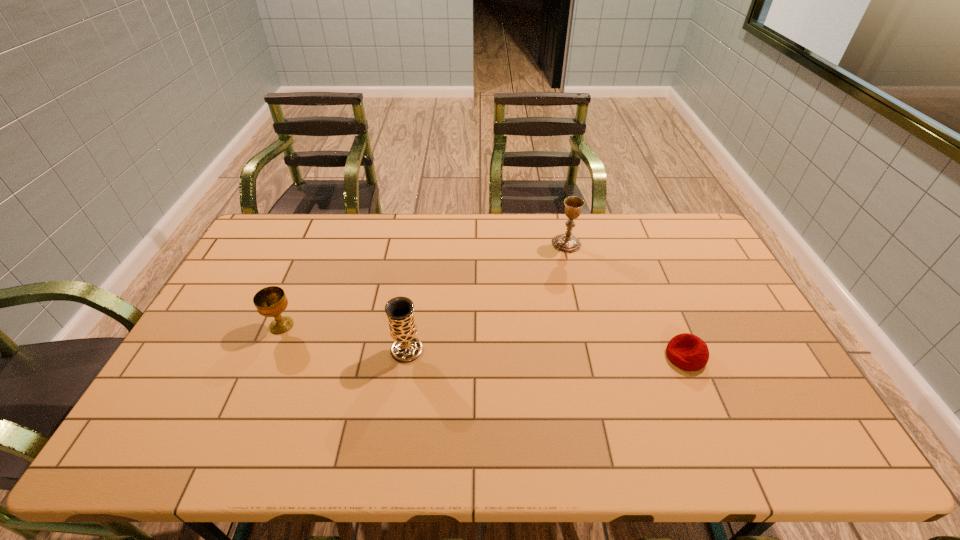
Locate an element on the screen. The height and width of the screenshot is (540, 960). vacant area located 0.270m on the right of the second farthest object is located at coordinates (388, 325).

In order to click on blank space located 0.220m on the seat area of the beanbag in this screenshot , I will do `click(587, 356)`.

This screenshot has width=960, height=540. What are the coordinates of `free spot located 0.060m on the seat area of the beanbag` in the screenshot? It's located at (644, 356).

Where is `vacant space situated on the seat area of the beanbag`? vacant space situated on the seat area of the beanbag is located at coordinates (557, 356).

Locate an element on the screen. This screenshot has width=960, height=540. object situated at the far edge is located at coordinates (567, 243).

Where is `vacant area at the far edge of the desktop`? This screenshot has width=960, height=540. vacant area at the far edge of the desktop is located at coordinates (367, 254).

You are a GUI agent. You are given a task and a screenshot of the screen. Output one action in this format:
    pyautogui.click(x=<x>, y=<y>)
    Task: Click on the vacant space at the near edge of the desktop
    
    Given the screenshot: What is the action you would take?
    pyautogui.click(x=224, y=433)

At what (x,y) coordinates should I click in order to perform the action: click on free space at the left edge of the desktop. Please return your answer as a coordinate pair (x, y). The width and height of the screenshot is (960, 540). Looking at the image, I should click on (264, 282).

Find the location of a particular element. This screenshot has width=960, height=540. free space at the right edge of the desktop is located at coordinates (747, 323).

Where is `free region at the near left corner`? free region at the near left corner is located at coordinates (186, 435).